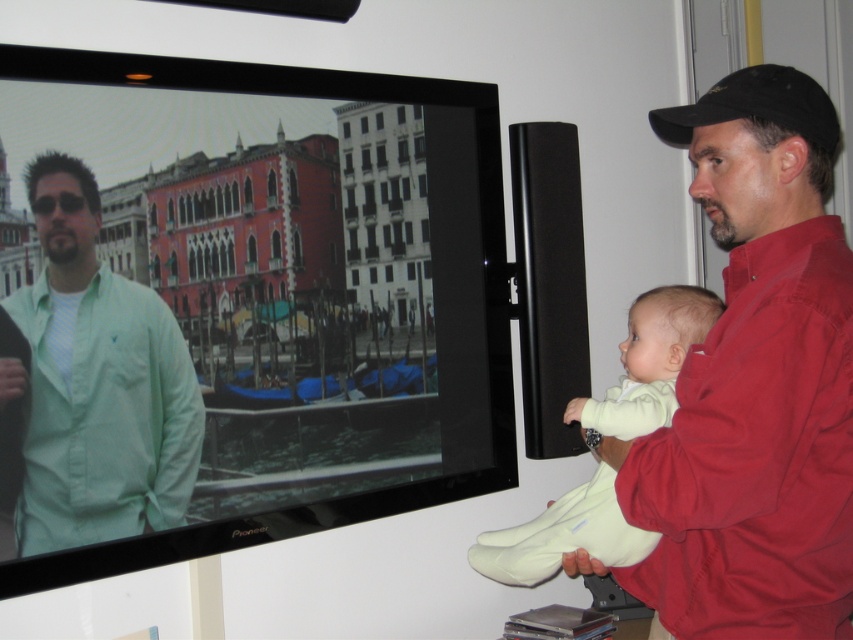
Question: Which point is farther from the camera taking this photo?

Choices:
 (A) (746, 74)
 (B) (254, 170)
 (C) (563, 536)
 (D) (807, 381)

Answer: (B)

Question: Can you confirm if matte black television at upper left is positioned above light yellow fabric baby at right?

Choices:
 (A) no
 (B) yes

Answer: (B)

Question: Does red cotton shirt at right have a lesser width compared to green cotton shirt at left?

Choices:
 (A) no
 (B) yes

Answer: (A)

Question: Can you confirm if red cotton shirt at right is smaller than black fabric baseball cap at upper right?

Choices:
 (A) yes
 (B) no

Answer: (B)

Question: Based on their relative distances, which object is nearer to the green cotton shirt at left?

Choices:
 (A) matte black television at upper left
 (B) red cotton shirt at right

Answer: (A)

Question: Which object appears closest to the camera in this image?

Choices:
 (A) matte black television at upper left
 (B) black fabric baseball cap at upper right
 (C) red cotton shirt at right

Answer: (C)